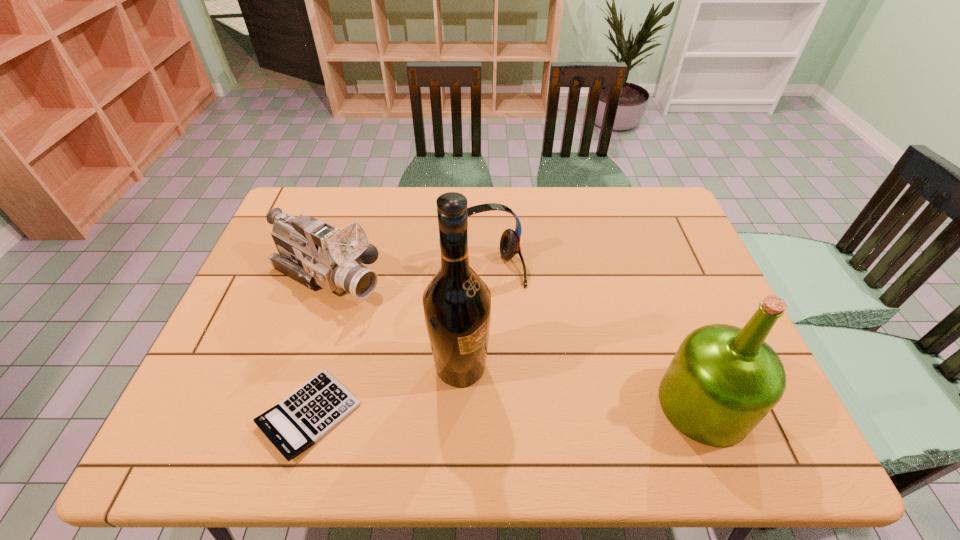
Locate an element on the screen. free spot on the desktop that is between the shortest object and the olive oil and is positioned on the front-facing side of the camcorder is located at coordinates (551, 408).

Locate an element on the screen. vacant space on the desktop that is between the shortest object and the rightmost object and is positioned with the microphone attached to the side of the headset is located at coordinates (553, 408).

Locate an element on the screen. Image resolution: width=960 pixels, height=540 pixels. vacant spot on the desktop that is between the calculator and the rightmost object and is positioned on the label of the wine bottle is located at coordinates (538, 409).